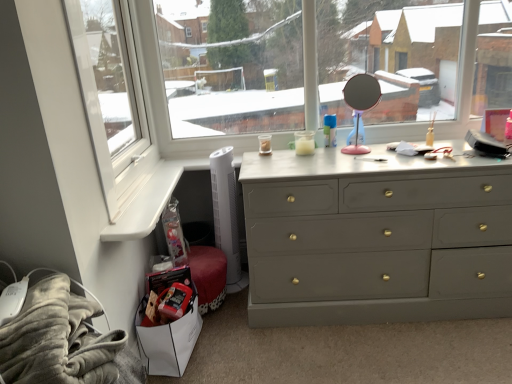
Measure the distance between point (352, 99) and camera.

6.58 feet.

This screenshot has width=512, height=384. Identify the location of white plastic window frame at left. (112, 98).

Find the location of a particular element. This screenshot has width=512, height=384. pink plastic mirror at upper center is located at coordinates coord(360,104).

From the picture: Does pink plastic mirror at upper center come in front of fuzzy gray blanket at lower left?

That is False.

Considering the relative sizes of pink plastic mirror at upper center and fuzzy gray blanket at lower left in the image provided, is pink plastic mirror at upper center bigger than fuzzy gray blanket at lower left?

Actually, pink plastic mirror at upper center might be smaller than fuzzy gray blanket at lower left.

From a real-world perspective, which object stands above the other?

From a 3D spatial view, pink plastic mirror at upper center is above.

Can you see pink plastic mirror at upper center touching fuzzy gray blanket at lower left?

pink plastic mirror at upper center and fuzzy gray blanket at lower left are clearly separated.

Which object is further away from the camera taking this photo, white plastic window sill at lower left or pink plastic mirror at upper center?

pink plastic mirror at upper center is behind.

Considering the relative sizes of white plastic window sill at lower left and pink plastic mirror at upper center in the image provided, is white plastic window sill at lower left bigger than pink plastic mirror at upper center?

Actually, white plastic window sill at lower left might be smaller than pink plastic mirror at upper center.

Could you tell me if white plastic window sill at lower left is facing pink plastic mirror at upper center?

No, white plastic window sill at lower left is not facing towards pink plastic mirror at upper center.

Are white plastic window sill at lower left and pink plastic mirror at upper center located far from each other?

No.

Between point (0, 361) and point (358, 88), which one is positioned behind?

The point (358, 88) is behind.

Which object is further away from the camera taking this photo, fuzzy gray blanket at lower left or pink plastic mirror at upper center?

Positioned behind is pink plastic mirror at upper center.

Looking at the image, does fuzzy gray blanket at lower left seem bigger or smaller compared to pink plastic mirror at upper center?

Clearly, fuzzy gray blanket at lower left is larger in size than pink plastic mirror at upper center.

Is fuzzy gray blanket at lower left far from matte gray dresser at center?

Yes, fuzzy gray blanket at lower left and matte gray dresser at center are located far from each other.

This screenshot has width=512, height=384. What are the coordinates of `material that appears above the matte gray dresser at center (from a real-world perspective)` in the screenshot? It's located at (58, 339).

Can you tell me how much fuzzy gray blanket at lower left and matte gray dresser at center differ in facing direction?

fuzzy gray blanket at lower left and matte gray dresser at center are facing 88.4 degrees away from each other.

From the picture: Does fuzzy gray blanket at lower left have a lesser height compared to white plastic window frame at left?

Indeed, fuzzy gray blanket at lower left has a lesser height compared to white plastic window frame at left.

Consider the image. From a real-world perspective, is fuzzy gray blanket at lower left physically above white plastic window frame at left?

No, from a real-world perspective, fuzzy gray blanket at lower left is not on top of white plastic window frame at left.

Considering the positions of objects fuzzy gray blanket at lower left and white plastic window frame at left in the image provided, who is more to the right, fuzzy gray blanket at lower left or white plastic window frame at left?

From the viewer's perspective, fuzzy gray blanket at lower left appears more on the right side.

Looking at this image, could you tell me if fuzzy gray blanket at lower left is turned towards white plastic window frame at left?

No, fuzzy gray blanket at lower left is not facing towards white plastic window frame at left.

How distant is white plastic window sill at lower left from matte gray dresser at center?

They are 83.24 centimeters apart.

Is white plastic window sill at lower left positioned in front of matte gray dresser at center?

Yes, the depth of white plastic window sill at lower left is less than that of matte gray dresser at center.

Locate an element on the screen. This screenshot has width=512, height=384. chest of drawers on the right of white plastic window sill at lower left is located at coordinates (377, 238).

Between white plastic window sill at lower left and matte gray dresser at center, which one has larger width?

Wider between the two is white plastic window sill at lower left.

Which is farther, [358,81] or [416,307]?

The point [358,81] is behind.

From a real-world perspective, is pink plastic mirror at upper center above or below matte gray dresser at center?

pink plastic mirror at upper center is situated higher than matte gray dresser at center in the real world.

Measure the distance from pink plastic mirror at upper center to matte gray dresser at center.

52.91 centimeters.

Considering the relative sizes of pink plastic mirror at upper center and matte gray dresser at center in the image provided, is pink plastic mirror at upper center thinner than matte gray dresser at center?

Yes, pink plastic mirror at upper center is thinner than matte gray dresser at center.

Identify the location of mirror behind the fuzzy gray blanket at lower left. (360, 104).

Where is `mirror that is above the white plastic window sill at lower left (from a real-world perspective)`? The height and width of the screenshot is (384, 512). mirror that is above the white plastic window sill at lower left (from a real-world perspective) is located at coordinates (360, 104).

Considering their positions, is white plastic window sill at lower left positioned closer to fuzzy gray blanket at lower left than matte gray dresser at center?

white plastic window sill at lower left lies closer to fuzzy gray blanket at lower left than the other object.

Looking at this image, which object lies nearer to the anchor point white plastic window frame at left, white plastic window sill at lower left or fuzzy gray blanket at lower left?

white plastic window sill at lower left is positioned closer to the anchor white plastic window frame at left.

When comparing their distances from pink plastic mirror at upper center, does white plastic window sill at lower left or matte gray dresser at center seem closer?

matte gray dresser at center is closer to pink plastic mirror at upper center.

Based on their spatial positions, is white plastic window frame at left or fuzzy gray blanket at lower left closer to matte gray dresser at center?

white plastic window frame at left is closer to matte gray dresser at center.

From the image, which object appears to be nearer to matte gray dresser at center, white plastic window sill at lower left or fuzzy gray blanket at lower left?

white plastic window sill at lower left is closer to matte gray dresser at center.

From the image, which object appears to be nearer to pink plastic mirror at upper center, fuzzy gray blanket at lower left or matte gray dresser at center?

matte gray dresser at center lies closer to pink plastic mirror at upper center than the other object.

Looking at the image, which one is located closer to white plastic window sill at lower left, fuzzy gray blanket at lower left or pink plastic mirror at upper center?

The object closer to white plastic window sill at lower left is fuzzy gray blanket at lower left.

From the image, which object appears to be nearer to white plastic window sill at lower left, fuzzy gray blanket at lower left or matte gray dresser at center?

Among the two, fuzzy gray blanket at lower left is located nearer to white plastic window sill at lower left.

This screenshot has height=384, width=512. Find the location of `window sill between fuzzy gray blanket at lower left and matte gray dresser at center in the horizontal direction`. window sill between fuzzy gray blanket at lower left and matte gray dresser at center in the horizontal direction is located at coordinates (146, 204).

Locate an element on the screen. The width and height of the screenshot is (512, 384). material between white plastic window frame at left and pink plastic mirror at upper center in the horizontal direction is located at coordinates (58, 339).

At what (x,y) coordinates should I click in order to perform the action: click on material located between white plastic window frame at left and matte gray dresser at center in the left-right direction. Please return your answer as a coordinate pair (x, y). Looking at the image, I should click on point(58,339).

Identify the location of window sill between white plastic window frame at left and matte gray dresser at center in the horizontal direction. (146, 204).